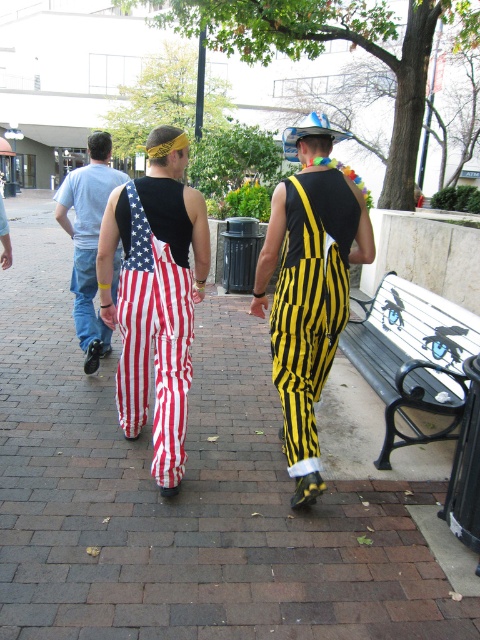
From the picture: Is red brick pavement at center to the right of metallic silver bench at right from the viewer's perspective?

Incorrect, red brick pavement at center is not on the right side of metallic silver bench at right.

Which is behind, point (58, 589) or point (375, 381)?

The point (375, 381) is more distant.

This screenshot has width=480, height=640. Find the location of `red brick pavement at center`. red brick pavement at center is located at coordinates (183, 493).

Can you confirm if american flag overalls at center is wider than american flag pants at left?

In fact, american flag overalls at center might be narrower than american flag pants at left.

Who is shorter, american flag overalls at center or american flag pants at left?

Standing shorter between the two is american flag overalls at center.

Who is more distant from viewer, [133,396] or [74,282]?

The point [74,282] is more distant.

I want to click on american flag overalls at center, so click(x=156, y=296).

Does point (132, 412) lie behind point (350, 256)?

Yes, it is.

Find the location of a particular element. The width and height of the screenshot is (480, 640). american flag overalls at center is located at coordinates (156, 296).